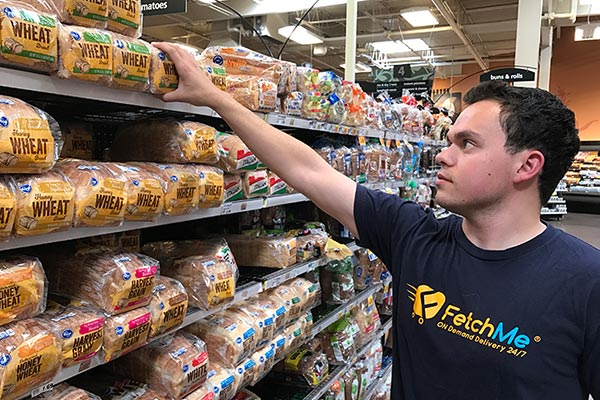
Where is `shelves`? This screenshot has height=400, width=600. shelves is located at coordinates (190, 215), (78, 92), (245, 288), (293, 275).